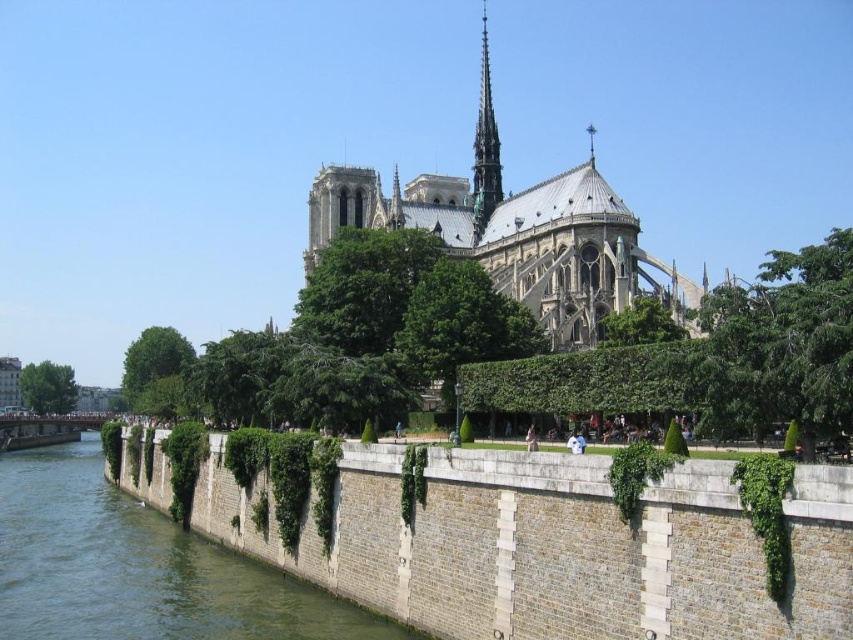
Question: Based on their relative distances, which object is nearer to the gray stone wall at lower left?

Choices:
 (A) smooth gray spire at upper center
 (B) green leafy tree at lower left
 (C) green stone wall at lower left

Answer: (C)

Question: Does green stone wall at lower left appear on the right side of green leafy tree at lower left?

Choices:
 (A) yes
 (B) no

Answer: (A)

Question: In this image, where is gray stone wall at lower left located relative to green stone wall at lower left?

Choices:
 (A) below
 (B) above

Answer: (B)

Question: Which of the following is the farthest from the observer?

Choices:
 (A) green leafy tree at center right
 (B) green stone wall at lower left
 (C) smooth gray spire at upper center
 (D) gray stone wall at lower left

Answer: (C)

Question: Which object is farther from the camera taking this photo?

Choices:
 (A) green leafy tree at center right
 (B) stone gothic cathedral at center

Answer: (B)

Question: Does green leafy tree at center right appear on the right side of green leafy tree at center-left?

Choices:
 (A) no
 (B) yes

Answer: (B)